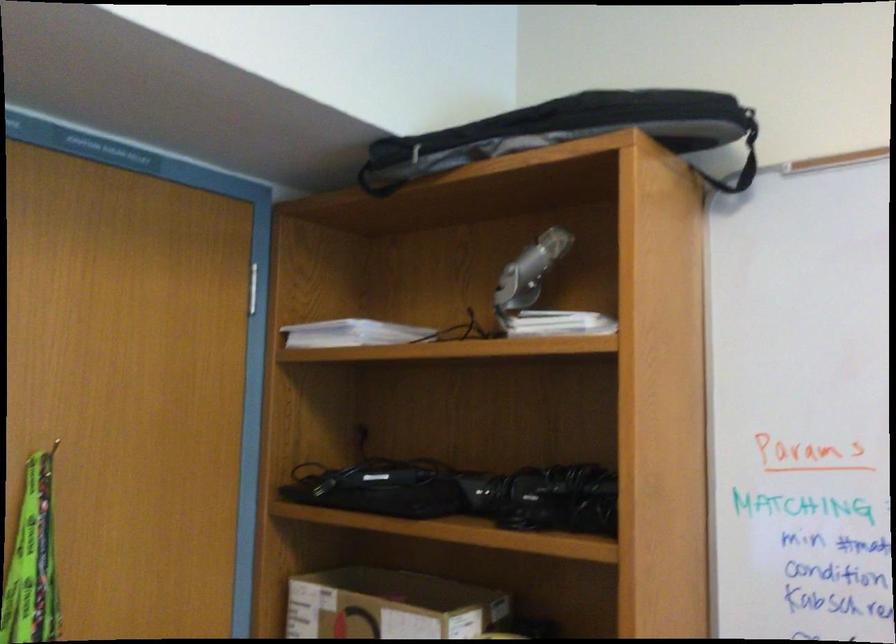
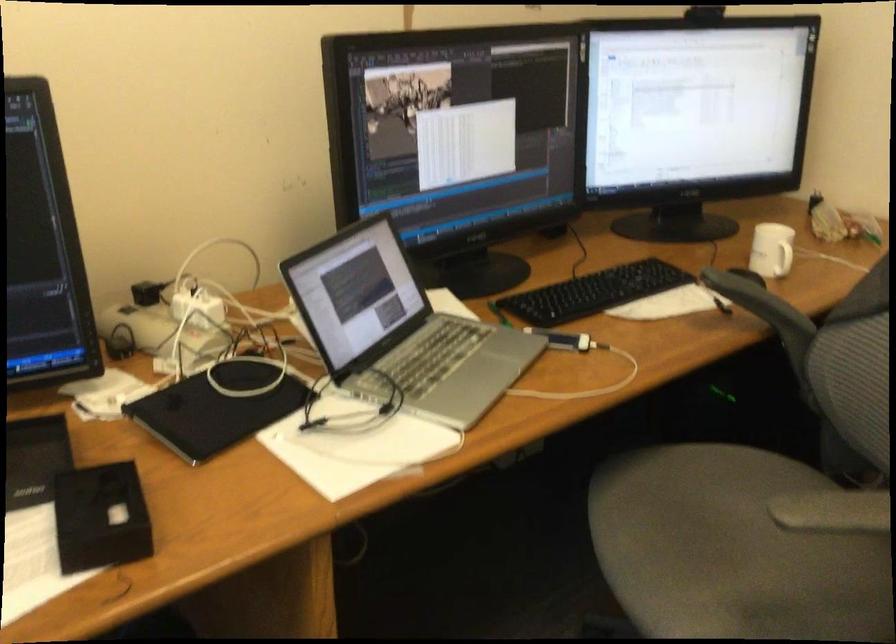
The first image is from the beginning of the video and the second image is from the end. How did the camera likely rotate when shooting the video?

The camera's rotation is toward left-down.